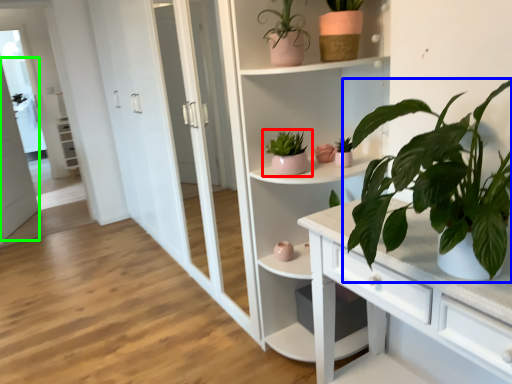
Question: Which object is the closest to the houseplant (highlighted by a red box)? Choose among these: houseplant (highlighted by a blue box) or screen door (highlighted by a green box).

Choices:
 (A) houseplant
 (B) screen door

Answer: (A)